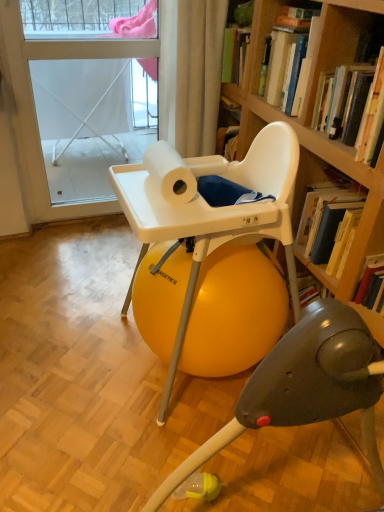
Describe the element at coordinates (336, 41) in the screenshot. I see `hardcover book at upper right, the 2th book from the front` at that location.

What do you see at coordinates (170, 173) in the screenshot? The image size is (384, 512). I see `white matte paper towel at center` at bounding box center [170, 173].

Locate an element on the screen. The width and height of the screenshot is (384, 512). hardcover book at upper right, the 1th book from the front is located at coordinates (355, 103).

In the scene shown: Which of these two, white matte paper towel at center or white fabric curtain at upper center, stands shorter?

white matte paper towel at center is shorter.

From a real-world perspective, which object rests below the other?

In real-world perspective, white matte paper towel at center is lower.

Is white matte paper towel at center not inside white fabric curtain at upper center?

white matte paper towel at center lies outside white fabric curtain at upper center's area.

Are white matte paper towel at center and white fabric curtain at upper center making contact?

No, white matte paper towel at center is not with white fabric curtain at upper center.

Does white fabric curtain at upper center have a greater width compared to white matte paper towel at center?

Yes, white fabric curtain at upper center is wider than white matte paper towel at center.

From the image's perspective, which is above, white fabric curtain at upper center or white matte paper towel at center?

white fabric curtain at upper center, from the image's perspective.

In terms of height, does white fabric curtain at upper center look taller or shorter compared to white matte paper towel at center?

In the image, white fabric curtain at upper center appears to be taller than white matte paper towel at center.

From the picture: Is white fabric curtain at upper center smaller than white matte paper towel at center?

No.

From a real-world perspective, who is located lower, white plastic highchair at center or white fabric curtain at upper center?

In real-world perspective, white plastic highchair at center is lower.

Between white plastic highchair at center and white fabric curtain at upper center, which one is positioned in front?

white plastic highchair at center is closer to the camera.

Are white plastic highchair at center and white fabric curtain at upper center located far from each other?

No, white plastic highchair at center is in close proximity to white fabric curtain at upper center.

Can you tell me how much white plastic highchair at center and white fabric screen door at upper left differ in facing direction?

0.42 degrees separate the facing orientations of white plastic highchair at center and white fabric screen door at upper left.

Measure the distance from white plastic highchair at center to white fabric screen door at upper left.

white plastic highchair at center and white fabric screen door at upper left are 3.63 feet apart from each other.

Which is behind, point (219, 182) or point (29, 82)?

Positioned behind is point (29, 82).

From the picture: Which is behind, white plastic highchair at center or white fabric screen door at upper left?

white fabric screen door at upper left is further from the camera.

Can you confirm if white fabric screen door at upper left is thinner than hardcover book at upper right, the 1th book from the front?

Indeed, white fabric screen door at upper left has a lesser width compared to hardcover book at upper right, the 1th book from the front.

In the scene shown: Considering their positions, is white fabric screen door at upper left located in front of or behind hardcover book at upper right, the 1th book from the front?

white fabric screen door at upper left is behind hardcover book at upper right, the 1th book from the front.

Is white fabric screen door at upper left to the left of hardcover book at upper right, the 1th book from the front, from the viewer's perspective?

Yes.

How much distance is there between white fabric screen door at upper left and hardcover book at upper right, the 1th book from the front?

The distance of white fabric screen door at upper left from hardcover book at upper right, the 1th book from the front, is 3.90 feet.

Which of these two, hardcover book at upper right, the 2th book from the front, or white fabric screen door at upper left, stands shorter?

Standing shorter between the two is hardcover book at upper right, the 2th book from the front.

Could you tell me if hardcover book at upper right, which is the 1th book from back to front, is facing white fabric screen door at upper left?

No, hardcover book at upper right, which is the 1th book from back to front, is not turned towards white fabric screen door at upper left.

Does point (355, 15) come closer to viewer compared to point (128, 42)?

Yes.

Where is `screen door behind the hardcover book at upper right, the 2th book from the front`? screen door behind the hardcover book at upper right, the 2th book from the front is located at coordinates (35, 109).

Considering the relative sizes of hardcover book at upper right, the 1th book from the front, and white fabric screen door at upper left in the image provided, is hardcover book at upper right, the 1th book from the front, smaller than white fabric screen door at upper left?

Correct, hardcover book at upper right, the 1th book from the front, occupies less space than white fabric screen door at upper left.

Does hardcover book at upper right, the 1th book from the front, have a lesser width compared to white fabric screen door at upper left?

Incorrect, the width of hardcover book at upper right, the 1th book from the front, is not less than that of white fabric screen door at upper left.

From the image's perspective, does hardcover book at upper right, which is the 2th book in back-to-front order, appear lower than white fabric screen door at upper left?

Indeed, from the image's perspective, hardcover book at upper right, which is the 2th book in back-to-front order, is shown beneath white fabric screen door at upper left.

Identify the location of paper towel in front of the white fabric curtain at upper center. Image resolution: width=384 pixels, height=512 pixels. (170, 173).

At what (x,y) coordinates should I click in order to perform the action: click on curtain to the right of white matte paper towel at center. Please return your answer as a coordinate pair (x, y). The height and width of the screenshot is (512, 384). Looking at the image, I should click on (198, 74).

Based on their spatial positions, is hardcover book at upper right, which is the 2th book in back-to-front order, or white matte paper towel at center further from white plastic highchair at center?

Among the two, hardcover book at upper right, which is the 2th book in back-to-front order, is located further to white plastic highchair at center.

Based on their spatial positions, is white plastic highchair at center or white fabric screen door at upper left further from hardcover book at upper right, the 1th book from the front?

white fabric screen door at upper left is further to hardcover book at upper right, the 1th book from the front.

Looking at the image, which one is located further to white fabric screen door at upper left, hardcover book at upper right, the 1th book from the front, or white plastic highchair at center?

Among the two, hardcover book at upper right, the 1th book from the front, is located further to white fabric screen door at upper left.

When comparing their distances from white fabric screen door at upper left, does white matte paper towel at center or white plastic highchair at center seem closer?

white matte paper towel at center.

Looking at the image, which one is located closer to white fabric curtain at upper center, hardcover book at upper right, the 2th book from the front, or white matte paper towel at center?

The object closer to white fabric curtain at upper center is hardcover book at upper right, the 2th book from the front.

Considering their positions, is white matte paper towel at center positioned further to hardcover book at upper right, the 1th book from the front, than white fabric screen door at upper left?

Based on the image, white fabric screen door at upper left appears to be further to hardcover book at upper right, the 1th book from the front.

Looking at the image, which one is located closer to hardcover book at upper right, which is the 2th book in back-to-front order, white plastic highchair at center or white fabric curtain at upper center?

Based on the image, white plastic highchair at center appears to be nearer to hardcover book at upper right, which is the 2th book in back-to-front order.

Based on their spatial positions, is white plastic highchair at center or white fabric curtain at upper center further from white fabric screen door at upper left?

white plastic highchair at center is further to white fabric screen door at upper left.

The width and height of the screenshot is (384, 512). I want to click on paper towel that lies between white fabric curtain at upper center and white plastic highchair at center from top to bottom, so click(170, 173).

Locate an element on the screen. Image resolution: width=384 pixels, height=512 pixels. book between white fabric curtain at upper center and hardcover book at upper right, the 1th book from the front, in the horizontal direction is located at coordinates (336, 41).

I want to click on paper towel located between white fabric screen door at upper left and hardcover book at upper right, the 1th book from the front, in the left-right direction, so click(170, 173).

Image resolution: width=384 pixels, height=512 pixels. What are the coordinates of `paper towel between white fabric screen door at upper left and white plastic highchair at center vertically` in the screenshot? It's located at (170, 173).